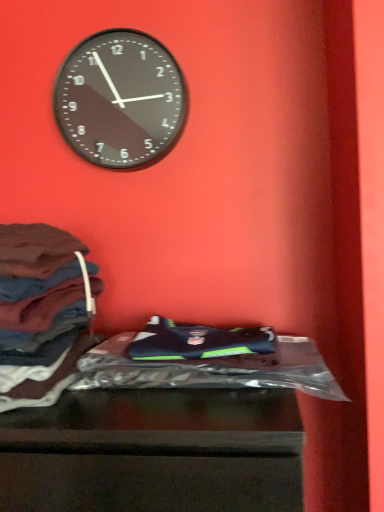
Question: From a real-world perspective, is dark brown fabric at left physically located above or below shiny plastic bag at center?

Choices:
 (A) above
 (B) below

Answer: (A)

Question: In terms of width, does dark brown fabric at left look wider or thinner when compared to shiny plastic bag at center?

Choices:
 (A) wide
 (B) thin

Answer: (A)

Question: Which of these objects is positioned farthest from the shiny plastic bag at center?

Choices:
 (A) dark brown fabric at left
 (B) black glass clock at upper center
 (C) shiny plastic bag at lower center

Answer: (B)

Question: Considering the real-world distances, which object is closest to the shiny plastic bag at lower center?

Choices:
 (A) black glass clock at upper center
 (B) dark brown fabric at left
 (C) shiny plastic bag at center

Answer: (C)